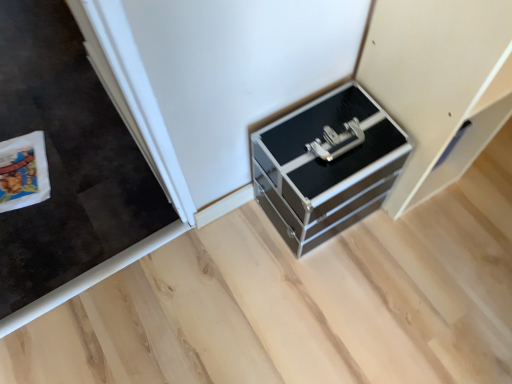
At what (x,y) coordinates should I click in order to perform the action: click on metallic silver drawer at lower right. Please return your answer as a coordinate pair (x, y). The width and height of the screenshot is (512, 384). Looking at the image, I should click on (439, 83).

Describe the element at coordinates (439, 83) in the screenshot. I see `metallic silver drawer at lower right` at that location.

What do you see at coordinates (326, 165) in the screenshot? I see `metallic black chest of drawers at center` at bounding box center [326, 165].

Measure the distance between point (353,213) and camera.

The distance of point (353,213) from camera is 3.81 feet.

I want to click on metallic black chest of drawers at center, so click(326, 165).

What are the coordinates of `metallic silver drawer at lower right` in the screenshot? It's located at 439,83.

From the picture: Considering the relative positions of metallic black chest of drawers at center and metallic silver drawer at lower right in the image provided, is metallic black chest of drawers at center to the left of metallic silver drawer at lower right from the viewer's perspective?

Correct, you'll find metallic black chest of drawers at center to the left of metallic silver drawer at lower right.

Which object is further away from the camera taking this photo, metallic black chest of drawers at center or metallic silver drawer at lower right?

metallic black chest of drawers at center is more distant.

Is point (335, 102) more distant than point (463, 121)?

Yes, point (335, 102) is behind point (463, 121).

From the image's perspective, which one is positioned higher, metallic black chest of drawers at center or metallic silver drawer at lower right?

metallic silver drawer at lower right is shown above in the image.

From a real-world perspective, which is physically below, metallic black chest of drawers at center or metallic silver drawer at lower right?

metallic black chest of drawers at center is physically lower.

Which object is thinner, metallic black chest of drawers at center or metallic silver drawer at lower right?

With smaller width is metallic black chest of drawers at center.

Considering the relative sizes of metallic black chest of drawers at center and metallic silver drawer at lower right in the image provided, is metallic black chest of drawers at center taller than metallic silver drawer at lower right?

No.

In the scene shown: Is metallic black chest of drawers at center bigger than metallic silver drawer at lower right?

No, metallic black chest of drawers at center is not bigger than metallic silver drawer at lower right.

Is metallic silver drawer at lower right inside metallic black chest of drawers at center?

No, metallic black chest of drawers at center does not contain metallic silver drawer at lower right.

Looking at this image, is metallic black chest of drawers at center not close to metallic silver drawer at lower right?

No, metallic black chest of drawers at center is not far away from metallic silver drawer at lower right.

Is metallic black chest of drawers at center aimed at metallic silver drawer at lower right?

No, metallic black chest of drawers at center is not oriented towards metallic silver drawer at lower right.

What's the angular difference between metallic black chest of drawers at center and metallic silver drawer at lower right's facing directions?

The angle between the facing direction of metallic black chest of drawers at center and the facing direction of metallic silver drawer at lower right is 0.937 degrees.

Measure the distance between metallic black chest of drawers at center and metallic silver drawer at lower right.

A distance of 7.89 inches exists between metallic black chest of drawers at center and metallic silver drawer at lower right.

Identify the location of the chest of drawers below the metallic silver drawer at lower right (from the image's perspective). The image size is (512, 384). (326, 165).

Does metallic silver drawer at lower right appear on the right side of metallic black chest of drawers at center?

Yes.

Looking at this image, which object is more forward, metallic silver drawer at lower right or metallic black chest of drawers at center?

Positioned in front is metallic silver drawer at lower right.

Which is more distant, (x=500, y=105) or (x=326, y=125)?

The point (x=500, y=105) is farther from the camera.

From the image's perspective, which is above, metallic silver drawer at lower right or metallic black chest of drawers at center?

metallic silver drawer at lower right.

From a real-world perspective, is metallic silver drawer at lower right physically above metallic black chest of drawers at center?

Yes, from a real-world perspective, metallic silver drawer at lower right is above metallic black chest of drawers at center.

Is metallic silver drawer at lower right wider or thinner than metallic black chest of drawers at center?

metallic silver drawer at lower right is wider than metallic black chest of drawers at center.

Considering the relative sizes of metallic silver drawer at lower right and metallic black chest of drawers at center in the image provided, is metallic silver drawer at lower right taller than metallic black chest of drawers at center?

Indeed, metallic silver drawer at lower right has a greater height compared to metallic black chest of drawers at center.

Can you confirm if metallic silver drawer at lower right is smaller than metallic black chest of drawers at center?

No, metallic silver drawer at lower right is not smaller than metallic black chest of drawers at center.

Does metallic silver drawer at lower right contain metallic black chest of drawers at center?

Definitely not — metallic black chest of drawers at center is not inside metallic silver drawer at lower right.

Is metallic silver drawer at lower right not near metallic black chest of drawers at center?

No, metallic silver drawer at lower right is not far away from metallic black chest of drawers at center.

Is metallic silver drawer at lower right facing towards metallic black chest of drawers at center?

No, metallic silver drawer at lower right does not turn towards metallic black chest of drawers at center.

How many degrees apart are the facing directions of metallic silver drawer at lower right and metallic black chest of drawers at center?

Answer: The angle between the facing direction of metallic silver drawer at lower right and the facing direction of metallic black chest of drawers at center is 0.937 degrees.

Find the location of a particular element. This screenshot has height=384, width=512. cabinetry located above the metallic black chest of drawers at center (from the image's perspective) is located at coordinates coord(439,83).

Image resolution: width=512 pixels, height=384 pixels. I want to click on cabinetry to the right of metallic black chest of drawers at center, so click(x=439, y=83).

Identify the location of the chest of drawers that appears below the metallic silver drawer at lower right (from a real-world perspective). (326, 165).